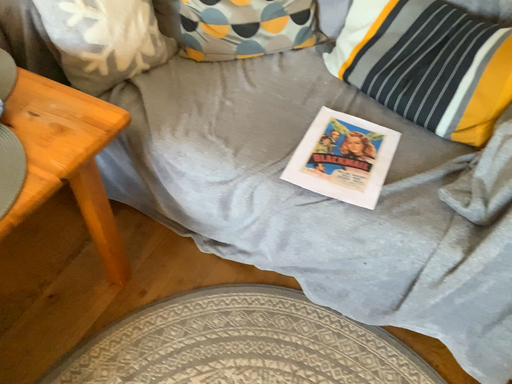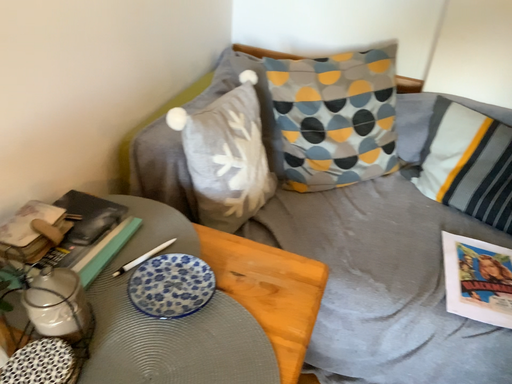
Question: How did the camera likely rotate when shooting the video?

Choices:
 (A) rotated downward
 (B) rotated upward

Answer: (B)